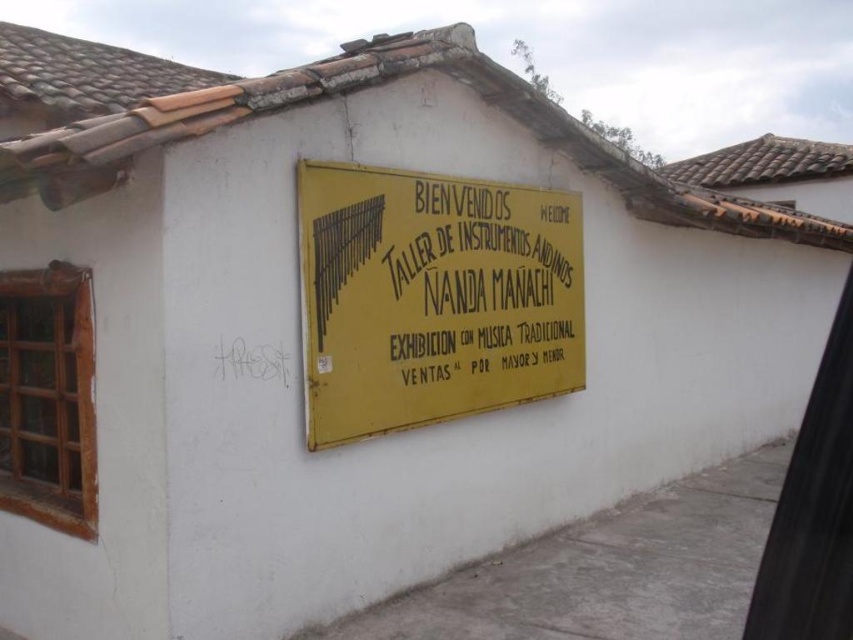
Question: Is yellow matte sign at center positioned before yellow paper sign at center?

Choices:
 (A) yes
 (B) no

Answer: (A)

Question: Is yellow matte sign at center to the left of yellow paper sign at center from the viewer's perspective?

Choices:
 (A) no
 (B) yes

Answer: (B)

Question: Is yellow matte sign at center smaller than yellow paper sign at center?

Choices:
 (A) yes
 (B) no

Answer: (B)

Question: Which point is farther to the camera?

Choices:
 (A) yellow paper sign at center
 (B) yellow matte sign at center

Answer: (A)

Question: Which point is farther to the camera?

Choices:
 (A) (428, 282)
 (B) (502, 209)

Answer: (B)

Question: Which point is farther to the camera?

Choices:
 (A) (550, 282)
 (B) (320, 208)

Answer: (A)